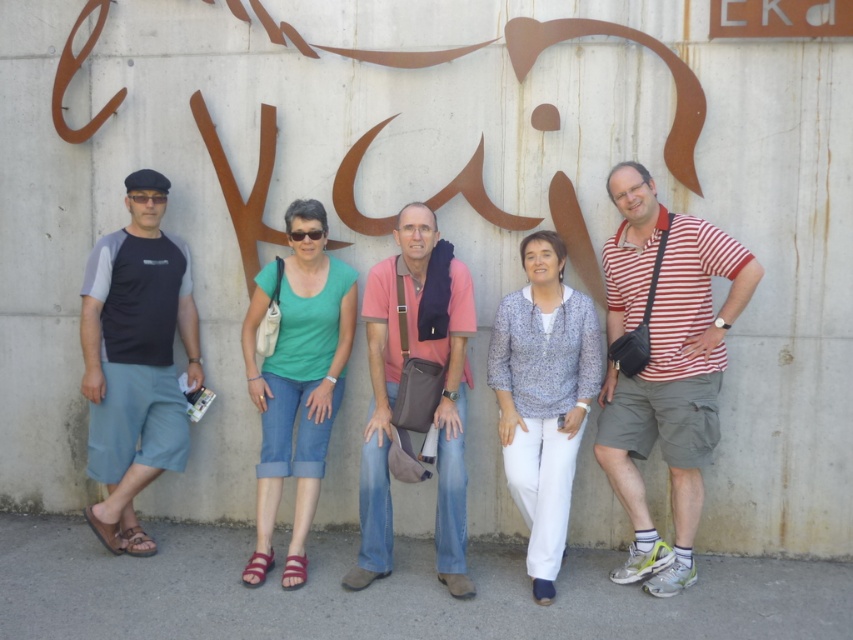
Who is positioned more to the right, gray-blue fabric shorts at left or matte green shirt at center?

matte green shirt at center

Can you confirm if gray-blue fabric shorts at left is positioned below matte green shirt at center?

Incorrect, gray-blue fabric shorts at left is not positioned below matte green shirt at center.

Does point (132, 390) come farther from viewer compared to point (279, 416)?

Yes, it is.

Identify the location of gray-blue fabric shorts at left. The width and height of the screenshot is (853, 640). (135, 360).

Is gray-blue fabric shorts at left smaller than pink fabric shirt at center?

Correct, gray-blue fabric shorts at left occupies less space than pink fabric shirt at center.

Between point (149, 365) and point (451, 536), which one is positioned in front?

Point (451, 536)

Find the location of a particular element. gray-blue fabric shorts at left is located at coordinates (135, 360).

Can you confirm if gray-blue fabric shorts at left is taller than patterned fabric blouse at center?

Yes.

Does gray-blue fabric shorts at left appear on the left side of patterned fabric blouse at center?

Indeed, gray-blue fabric shorts at left is positioned on the left side of patterned fabric blouse at center.

The width and height of the screenshot is (853, 640). What do you see at coordinates (135, 360) in the screenshot? I see `gray-blue fabric shorts at left` at bounding box center [135, 360].

Identify the location of gray-blue fabric shorts at left. Image resolution: width=853 pixels, height=640 pixels. 135,360.